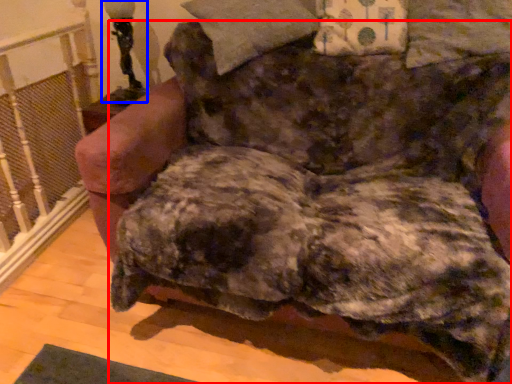
Question: Which object appears farthest to the camera in this image, dog (highlighted by a red box) or table lamp (highlighted by a blue box)?

Choices:
 (A) dog
 (B) table lamp

Answer: (B)